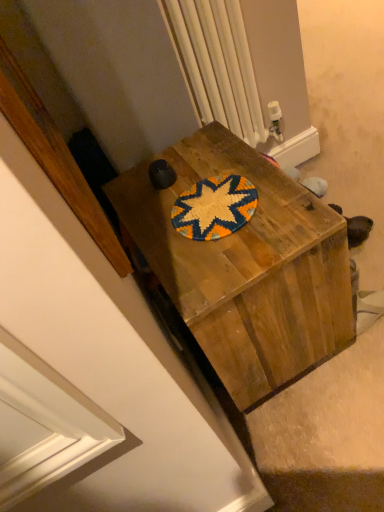
Question: Is wooden desk at center not within white plastic radiator at upper center?

Choices:
 (A) yes
 (B) no

Answer: (A)

Question: From the image's perspective, is wooden desk at center below white plastic radiator at upper center?

Choices:
 (A) yes
 (B) no

Answer: (A)

Question: Is wooden desk at center beside white plastic radiator at upper center?

Choices:
 (A) yes
 (B) no

Answer: (B)

Question: Does wooden desk at center contain white plastic radiator at upper center?

Choices:
 (A) yes
 (B) no

Answer: (B)

Question: Is wooden desk at center turned away from white plastic radiator at upper center?

Choices:
 (A) no
 (B) yes

Answer: (A)

Question: From a real-world perspective, is wooden desk at center physically above white plastic radiator at upper center?

Choices:
 (A) no
 (B) yes

Answer: (A)

Question: Is the surface of white plastic radiator at upper center in direct contact with wooden desk at center?

Choices:
 (A) yes
 (B) no

Answer: (B)

Question: Can you confirm if white plastic radiator at upper center is smaller than wooden desk at center?

Choices:
 (A) no
 (B) yes

Answer: (B)

Question: From the image's perspective, does white plastic radiator at upper center appear higher than wooden desk at center?

Choices:
 (A) no
 (B) yes

Answer: (B)

Question: Can you confirm if white plastic radiator at upper center is positioned to the right of wooden desk at center?

Choices:
 (A) no
 (B) yes

Answer: (B)

Question: Does white plastic radiator at upper center have a lesser width compared to wooden desk at center?

Choices:
 (A) yes
 (B) no

Answer: (A)

Question: Is white plastic radiator at upper center to the left of wooden desk at center from the viewer's perspective?

Choices:
 (A) yes
 (B) no

Answer: (B)

Question: Relative to white plastic radiator at upper center, is wooden desk at center in front or behind?

Choices:
 (A) front
 (B) behind

Answer: (A)